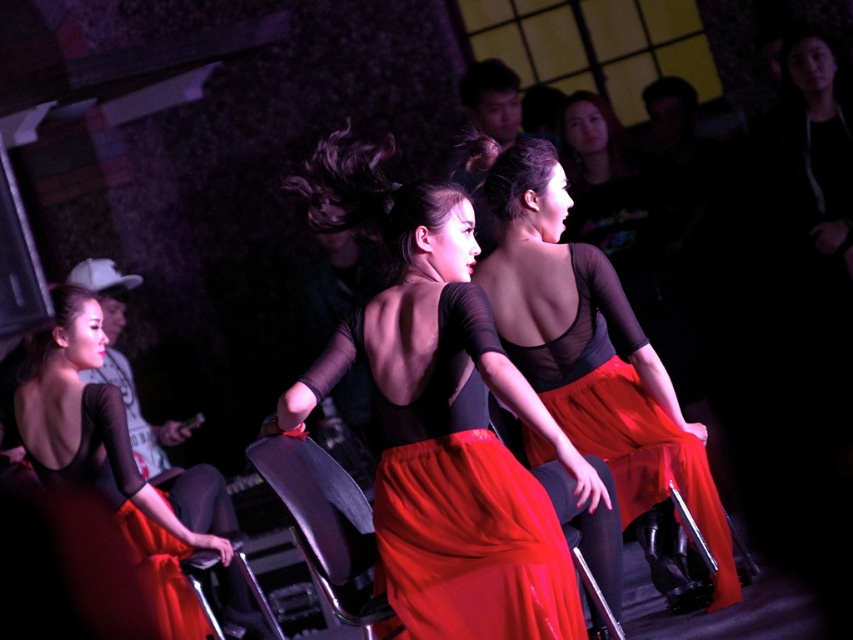
Is matte black top at center thinner than matte black dress at center?

Incorrect, matte black top at center's width is not less than matte black dress at center's.

Locate an element on the screen. matte black top at center is located at coordinates (592, 353).

Does point (708, 468) come behind point (122, 428)?

Yes, it is behind point (122, 428).

Where is `matte black top at center`? This screenshot has width=853, height=640. matte black top at center is located at coordinates (592, 353).

Does matte black top at center have a lesser width compared to matte black chair at center?

In fact, matte black top at center might be wider than matte black chair at center.

What do you see at coordinates (592, 353) in the screenshot? I see `matte black top at center` at bounding box center [592, 353].

Is point (572, 428) behind point (341, 474)?

Yes.

The image size is (853, 640). I want to click on matte black top at center, so click(592, 353).

Describe the element at coordinates (447, 432) in the screenshot. I see `matte black leotard at center` at that location.

In the scene shown: Does matte black leotard at center have a lesser height compared to matte black top at center?

Yes.

The height and width of the screenshot is (640, 853). In order to click on matte black leotard at center in this screenshot , I will do `click(447, 432)`.